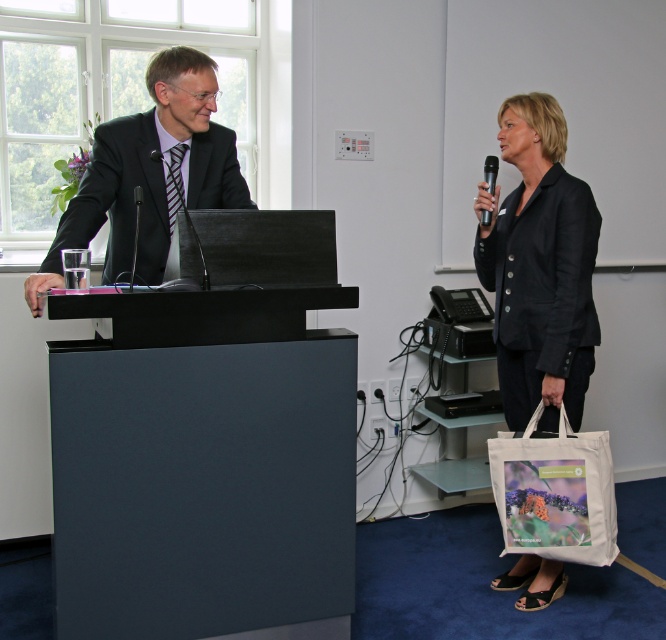
Question: Which of these objects is positioned farthest from the matte black suit at left?

Choices:
 (A) black matte blazer at right
 (B) matte black podium at left
 (C) white canvas tote at lower right
 (D) black plastic microphone at upper right

Answer: (C)

Question: From the image, what is the correct spatial relationship of matte black podium at left in relation to black matte blazer at right?

Choices:
 (A) above
 (B) below

Answer: (B)

Question: Which of the following is the closest to the observer?

Choices:
 (A) black matte blazer at right
 (B) white canvas tote at lower right
 (C) black plastic microphone at upper right
 (D) matte black suit at left

Answer: (D)

Question: Is matte black podium at left above black plastic microphone at upper right?

Choices:
 (A) yes
 (B) no

Answer: (B)

Question: Does matte black podium at left appear over matte black suit at left?

Choices:
 (A) no
 (B) yes

Answer: (A)

Question: Which point is closer to the camera?

Choices:
 (A) (599, 557)
 (B) (496, 300)
 (C) (178, 70)
 (D) (486, 218)

Answer: (C)